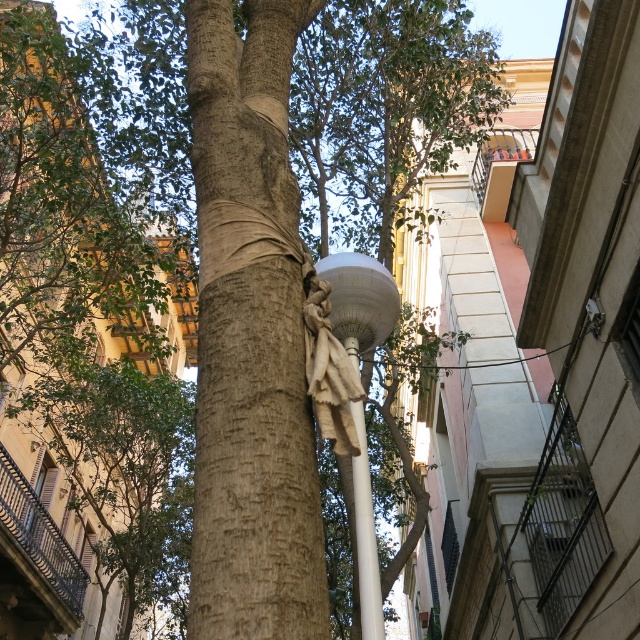
Question: Is white matte lamp post at center in front of white stone statue at center?

Choices:
 (A) yes
 (B) no

Answer: (A)

Question: Which object appears closest to the camera in this image?

Choices:
 (A) light brown bark tree trunk at center
 (B) white matte lamp post at center
 (C) white stone statue at center

Answer: (A)

Question: Is the position of light brown bark tree trunk at center more distant than that of white glossy pole at center?

Choices:
 (A) no
 (B) yes

Answer: (A)

Question: Among these points, which one is nearest to the camera?

Choices:
 (A) (362, 339)
 (B) (220, 452)
 (C) (323, 435)
 (D) (371, 595)

Answer: (B)

Question: Is white matte lamp post at center positioned at the back of white stone statue at center?

Choices:
 (A) no
 (B) yes

Answer: (A)

Question: Among these points, which one is farthest from the camera?

Choices:
 (A) (257, 262)
 (B) (353, 390)

Answer: (A)